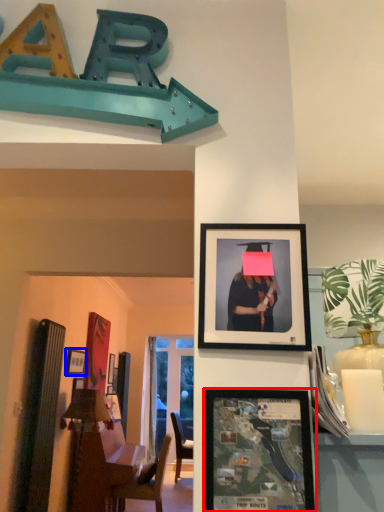
Question: Which object is closer to the camera taking this photo, picture frame (highlighted by a red box) or picture frame (highlighted by a blue box)?

Choices:
 (A) picture frame
 (B) picture frame

Answer: (A)